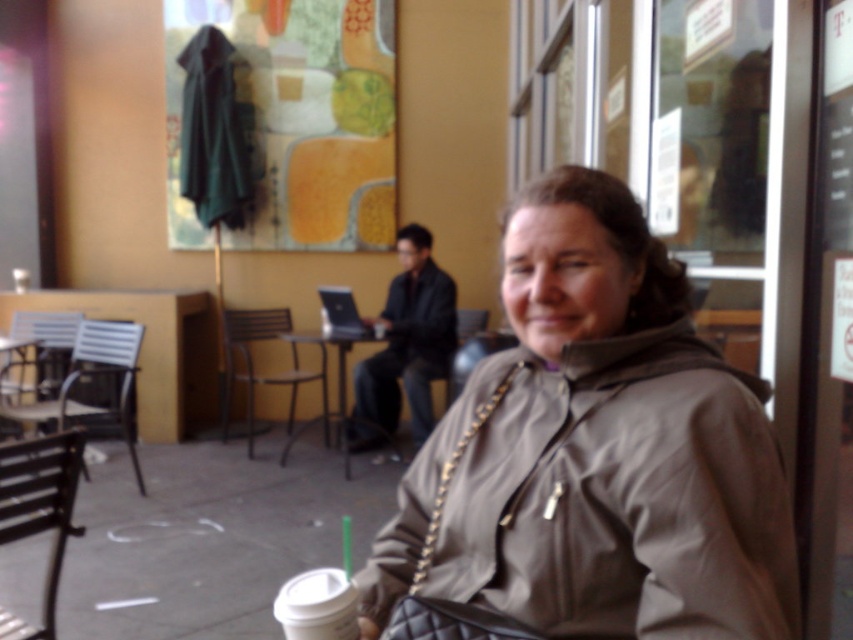
Question: Is matte gray jacket at center wider than metallic silver table at center?

Choices:
 (A) no
 (B) yes

Answer: (A)

Question: Which point is closer to the camera taking this photo?

Choices:
 (A) (358, 339)
 (B) (593, 198)

Answer: (B)

Question: Is matte gray jacket at center smaller than metallic silver table at center?

Choices:
 (A) yes
 (B) no

Answer: (A)

Question: Among these objects, which one is farthest from the camera?

Choices:
 (A) matte gray jacket at center
 (B) metallic silver table at center

Answer: (B)

Question: From the image, what is the correct spatial relationship of matte gray jacket at center in relation to metallic silver table at center?

Choices:
 (A) right
 (B) left

Answer: (A)